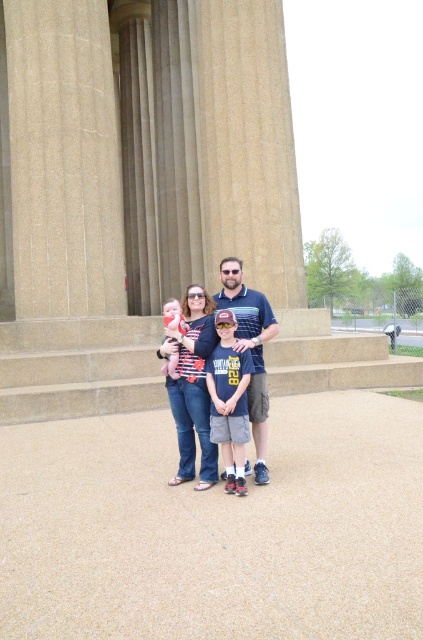
You are a photographer trying to adjust the lighting for the family photo. Since the denim shorts at center and the matte pink baby at center are both in the center, which one should you focus on to ensure the baby is properly lit?

The denim shorts at center is in front of the matte pink baby at center, so you should focus on the denim shorts at center to ensure the baby is properly lit.